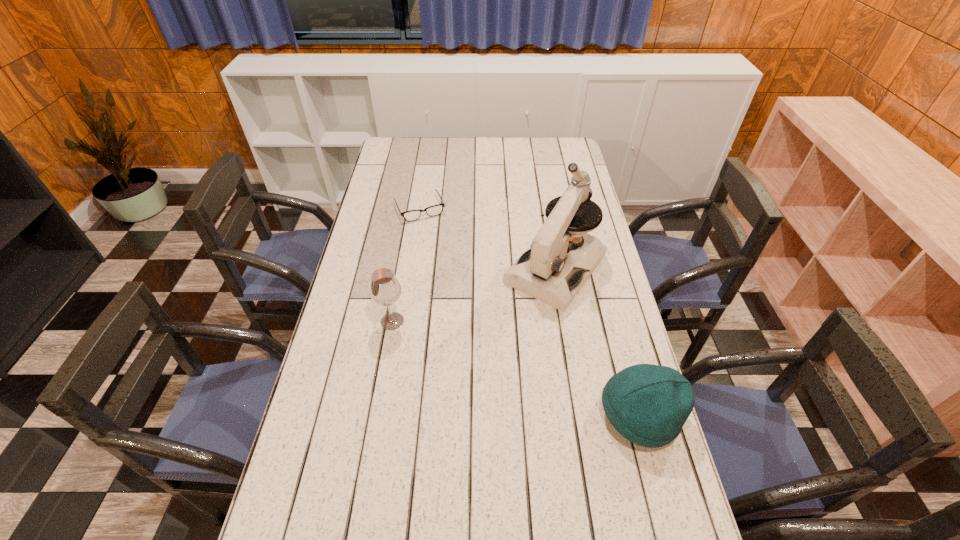
Locate an element on the screen. The width and height of the screenshot is (960, 540). free space between the second tallest object and the farthest object is located at coordinates (406, 265).

Image resolution: width=960 pixels, height=540 pixels. Identify the location of empty space that is in between the third shortest object and the spectacles. (406, 265).

Identify the location of free spot between the third shortest object and the microscope. The image size is (960, 540). (474, 295).

Where is `free space between the spectacles and the beanie`? This screenshot has height=540, width=960. free space between the spectacles and the beanie is located at coordinates 530,312.

Find the location of a particular element. This screenshot has height=540, width=960. object that is the third closest one to the microscope is located at coordinates (385, 289).

Identify which object is the nearest to the microscope. Please provide its 2D coordinates. Your answer should be formatted as a tuple, i.e. [(x, y)], where the tuple contains the x and y coordinates of a point satisfying the conditions above.

[(412, 215)]

You are a GUI agent. You are given a task and a screenshot of the screen. Output one action in this format:
    pyautogui.click(x=<x>, y=<y>)
    Task: Click on the free space that satisfies the following two spatial constraints: 1. on the back side of the wineglass; 2. on the right side of the tallest object
    The height and width of the screenshot is (540, 960).
    Given the screenshot: What is the action you would take?
    pyautogui.click(x=401, y=269)

Identify the location of free space that satisfies the following two spatial constraints: 1. on the front side of the beanie; 2. on the left side of the farthest object. The width and height of the screenshot is (960, 540). (387, 415).